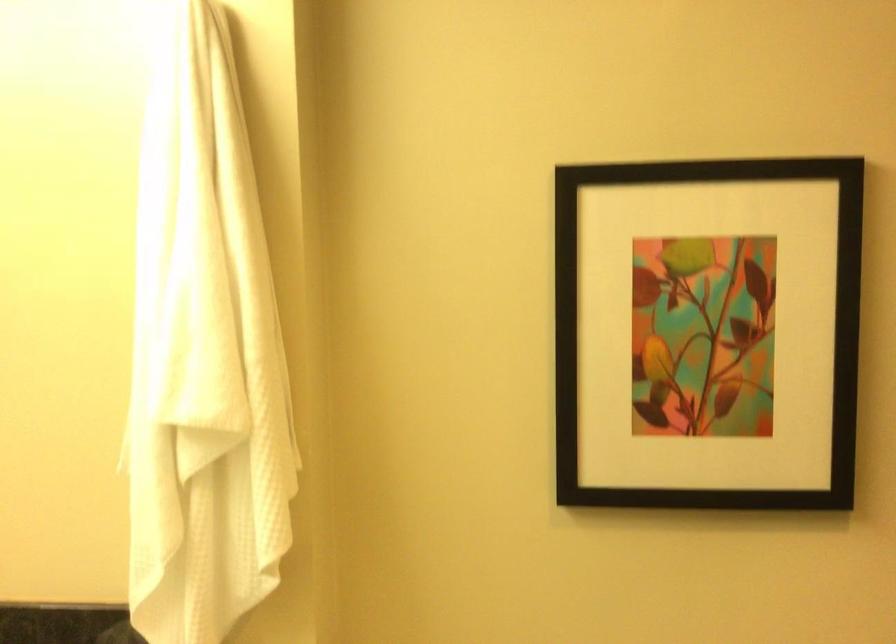
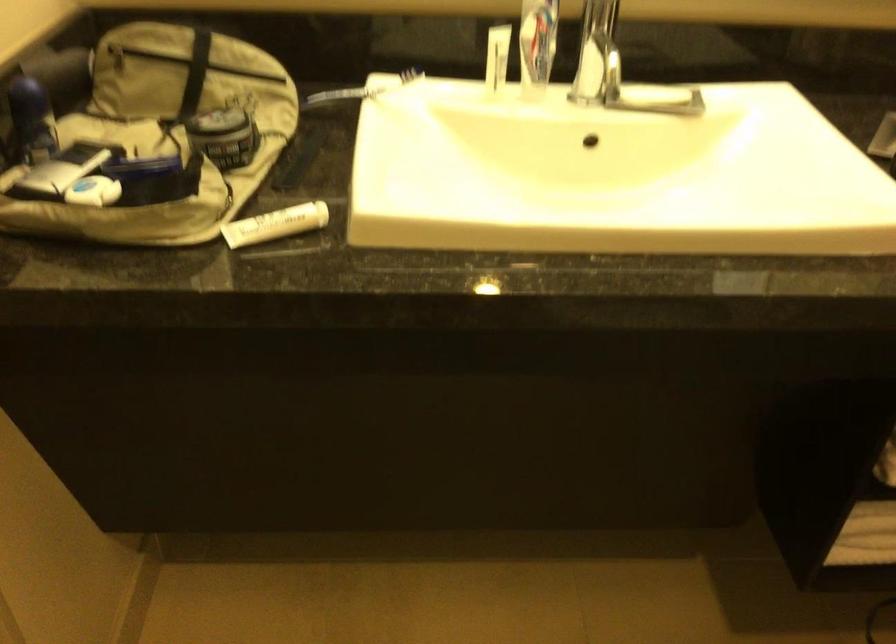
The images are taken continuously from a first-person perspective. In which direction is your viewpoint rotating?

The camera rotated toward left-down.